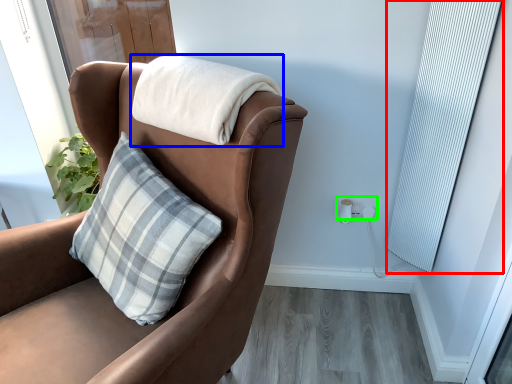
Question: Estimate the real-world distances between objects in this image. Which object is closer to curtain (highlighted by a red box), blanket (highlighted by a blue box) or electric outlet (highlighted by a green box)?

Choices:
 (A) blanket
 (B) electric outlet

Answer: (B)